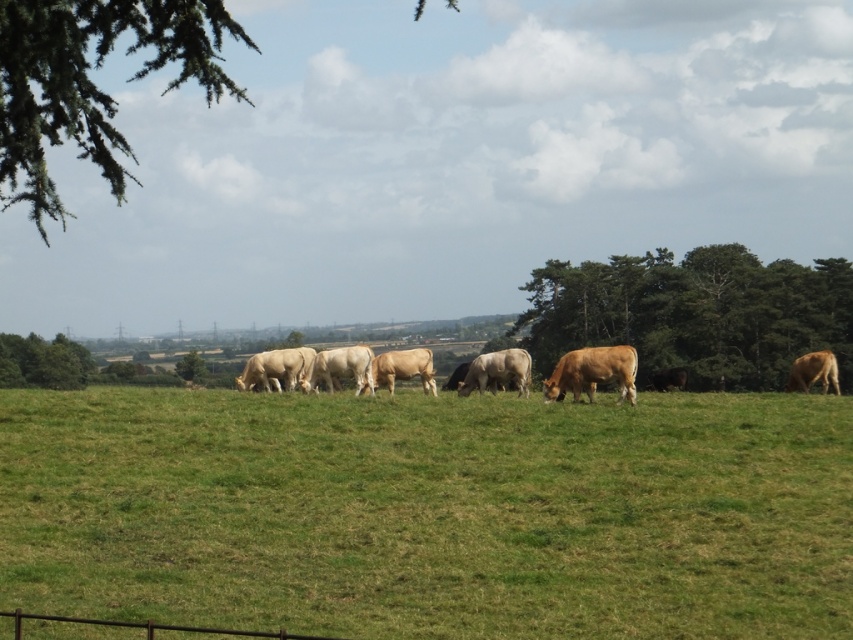
Does light brown smooth cow at center lie in front of brown smooth cow at right?

Yes, light brown smooth cow at center is closer to the viewer.

The image size is (853, 640). Describe the element at coordinates (497, 371) in the screenshot. I see `light brown smooth cow at center` at that location.

This screenshot has width=853, height=640. Find the location of `light brown smooth cow at center`. light brown smooth cow at center is located at coordinates (497, 371).

Find the location of a particular element. The height and width of the screenshot is (640, 853). light brown smooth cow at center is located at coordinates (497, 371).

Which of these two, white smooth cow at center or light brown cow at center, stands taller?

With more height is white smooth cow at center.

Where is `white smooth cow at center`? The width and height of the screenshot is (853, 640). white smooth cow at center is located at coordinates (340, 368).

Is light brown glossy cow at center shorter than green leafy tree at lower left?

Yes, light brown glossy cow at center is shorter than green leafy tree at lower left.

Who is higher up, light brown glossy cow at center or green leafy tree at lower left?

light brown glossy cow at center is higher up.

Who is more distant from viewer, (267,365) or (181,378)?

The point (181,378) is behind.

I want to click on light brown glossy cow at center, so click(274, 368).